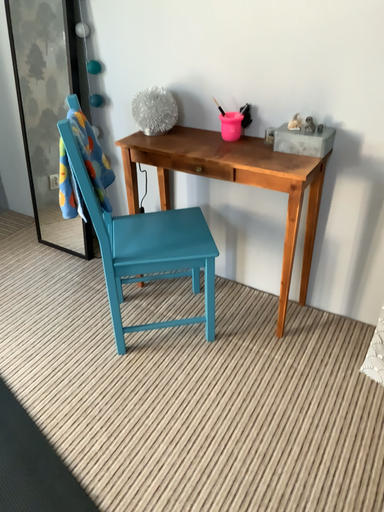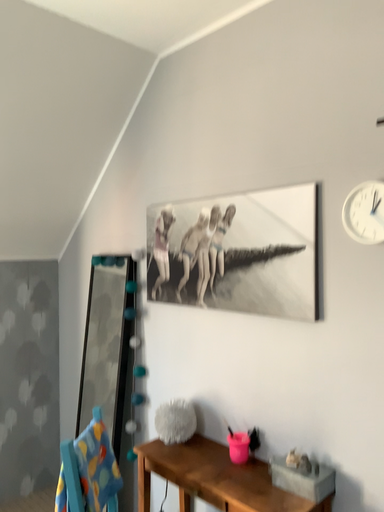
Question: How did the camera likely rotate when shooting the video?

Choices:
 (A) rotated right
 (B) rotated left

Answer: (B)